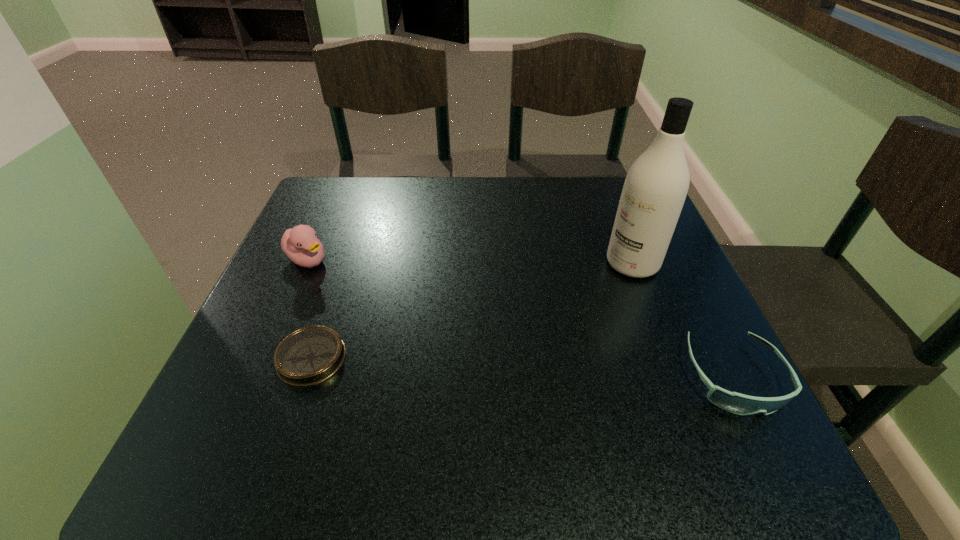
Identify the location of free space on the desktop that is between the compass and the goggles and is positioned on the front-facing side of the tallest object. [x=463, y=364].

You are a GUI agent. You are given a task and a screenshot of the screen. Output one action in this format:
    pyautogui.click(x=<x>, y=<y>)
    Task: Click on the free space on the desktop that is between the compass and the second shortest object and is positioned on the front-facing side of the duckling
    
    Given the screenshot: What is the action you would take?
    pyautogui.click(x=487, y=366)